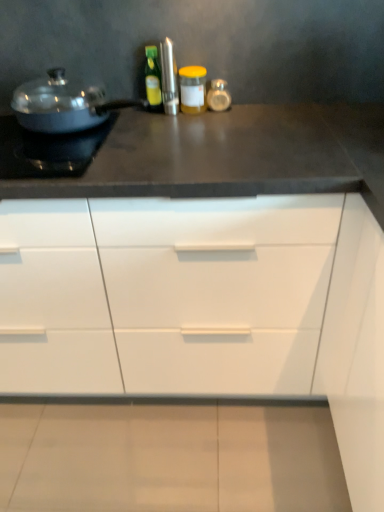
This screenshot has height=512, width=384. I want to click on free space in front of yellow matte jar at center, which ranks as the first bottle in right-to-left order, so click(173, 123).